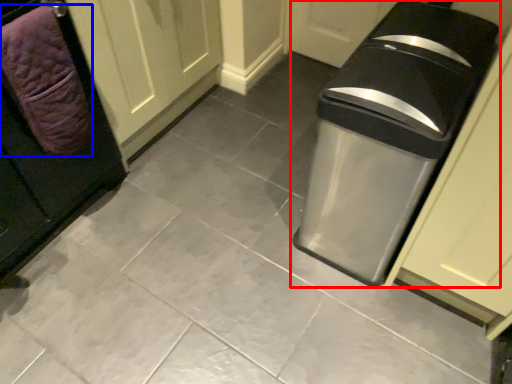
Question: Which point is further to the camera, waste container (highlighted by a red box) or blanket (highlighted by a blue box)?

Choices:
 (A) waste container
 (B) blanket

Answer: (B)